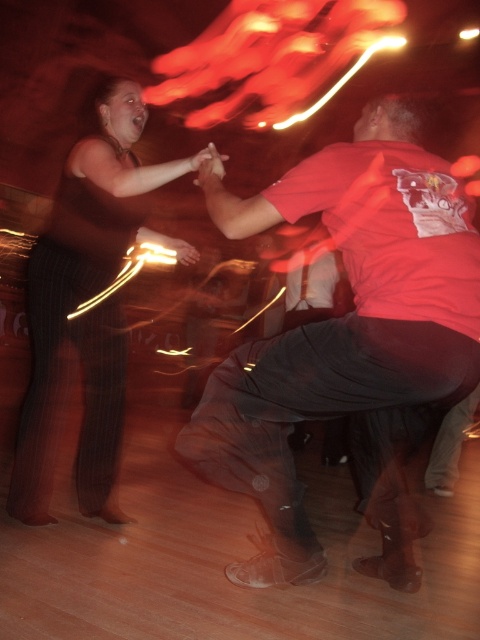
Question: Does matte red shirt at center have a smaller size compared to striped fabric pants at left?

Choices:
 (A) yes
 (B) no

Answer: (A)

Question: Is matte red shirt at center bigger than striped fabric pants at left?

Choices:
 (A) no
 (B) yes

Answer: (A)

Question: Which point is farther to the camera?

Choices:
 (A) (119, 360)
 (B) (392, 182)

Answer: (A)

Question: Is matte red shirt at center behind striped fabric pants at left?

Choices:
 (A) no
 (B) yes

Answer: (A)

Question: Among these objects, which one is farthest from the camera?

Choices:
 (A) striped fabric pants at left
 (B) matte red shirt at center

Answer: (A)